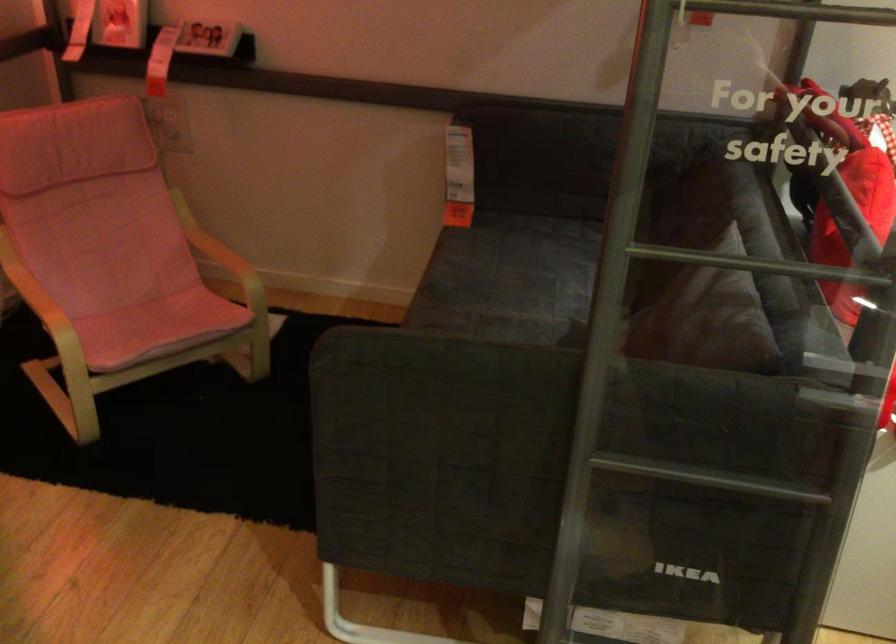
The first image is from the beginning of the video and the second image is from the end. How did the camera likely rotate when shooting the video?

The camera rotated toward left-down.